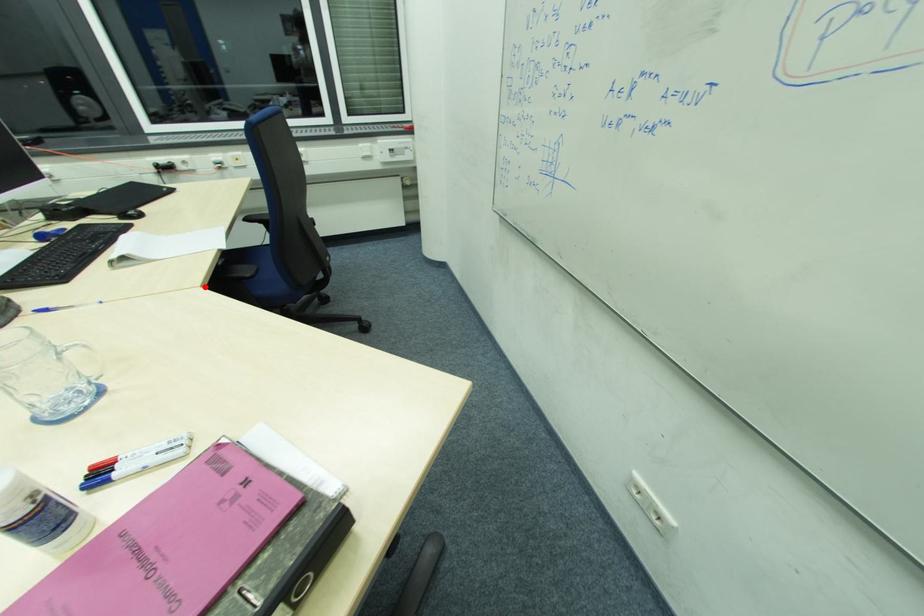
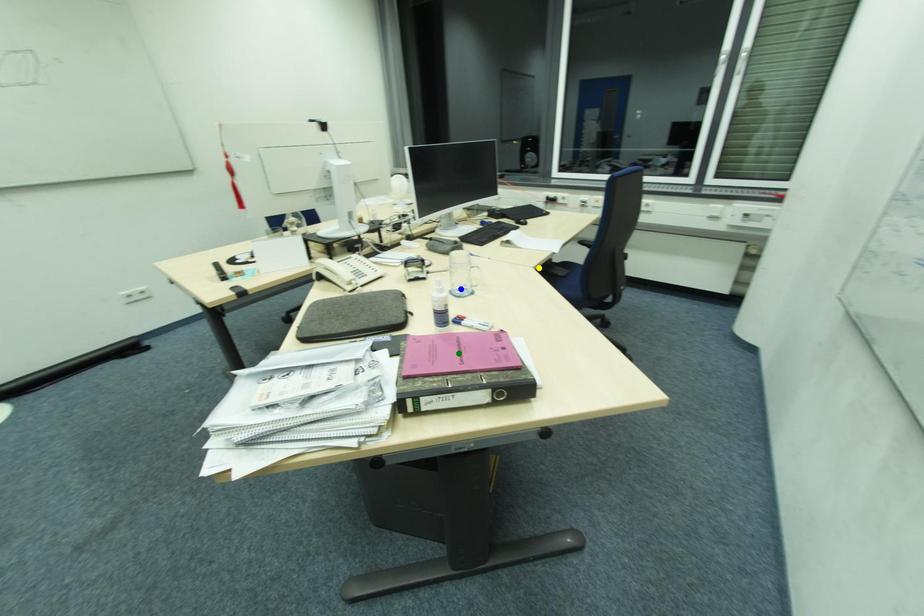
Question: I am providing you with two images of the same scene from different viewpoints. A red point is marked on the first image. You are given multiple points on the second image. In image 2, which mark is for the same physical point as the one in image 1?

Choices:
 (A) blue point
 (B) yellow point
 (C) green point

Answer: (B)